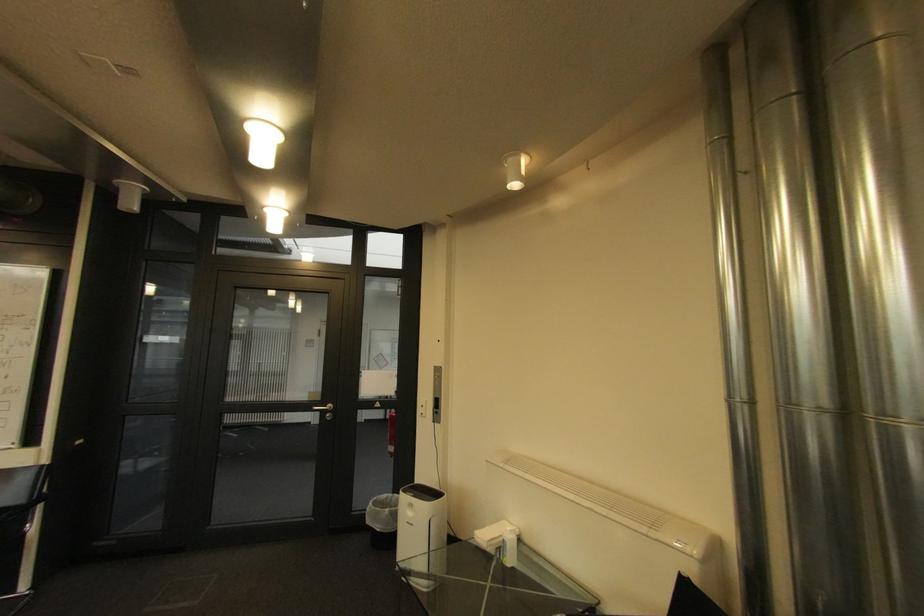
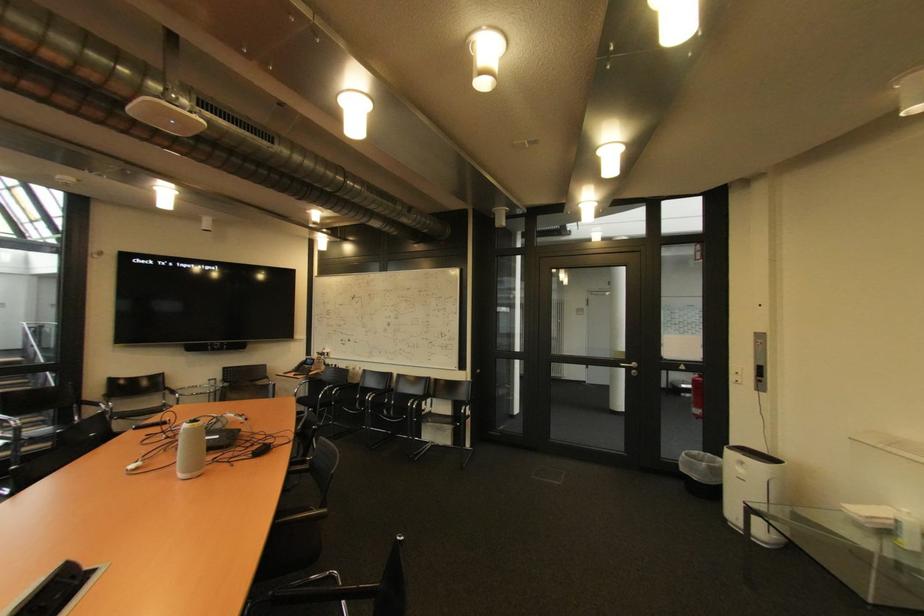
Find the pixel in the second image that matches point (418, 515) in the first image.

(748, 471)